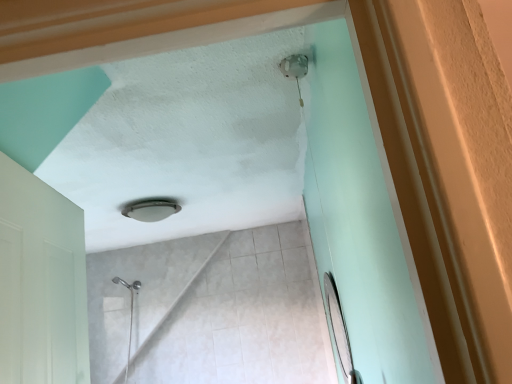
Question: Could you tell me if matte silver mirror at right is facing matte glass lamp at center?

Choices:
 (A) yes
 (B) no

Answer: (B)

Question: Would you say matte silver mirror at right is a long distance from matte glass lamp at center?

Choices:
 (A) no
 (B) yes

Answer: (B)

Question: Is matte silver mirror at right positioned beyond the bounds of matte glass lamp at center?

Choices:
 (A) yes
 (B) no

Answer: (A)

Question: From the image's perspective, is matte silver mirror at right over matte glass lamp at center?

Choices:
 (A) no
 (B) yes

Answer: (A)

Question: Would you say matte glass lamp at center is part of matte silver mirror at right's contents?

Choices:
 (A) yes
 (B) no

Answer: (B)

Question: Can you confirm if matte silver mirror at right is positioned to the right of matte glass lamp at center?

Choices:
 (A) no
 (B) yes

Answer: (B)

Question: Is matte glass lamp at center to the left of matte silver mirror at right from the viewer's perspective?

Choices:
 (A) no
 (B) yes

Answer: (B)

Question: From a real-world perspective, is matte glass lamp at center over matte silver mirror at right?

Choices:
 (A) yes
 (B) no

Answer: (A)

Question: Is matte glass lamp at center shorter than matte silver mirror at right?

Choices:
 (A) yes
 (B) no

Answer: (A)

Question: Considering the relative sizes of matte glass lamp at center and matte silver mirror at right in the image provided, is matte glass lamp at center wider than matte silver mirror at right?

Choices:
 (A) yes
 (B) no

Answer: (A)

Question: Does matte glass lamp at center have a larger size compared to matte silver mirror at right?

Choices:
 (A) yes
 (B) no

Answer: (B)

Question: Is matte glass lamp at center to the right of matte silver mirror at right from the viewer's perspective?

Choices:
 (A) no
 (B) yes

Answer: (A)

Question: From a real-world perspective, is matte silver mirror at right positioned above or below matte glass lamp at center?

Choices:
 (A) below
 (B) above

Answer: (A)